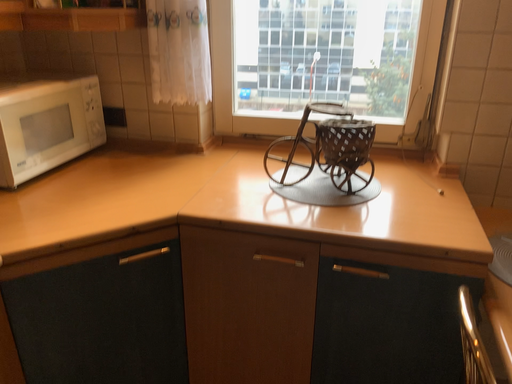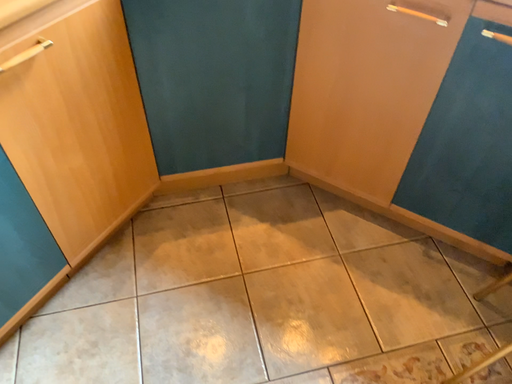
Question: Which way did the camera rotate in the video?

Choices:
 (A) rotated right
 (B) rotated left

Answer: (B)